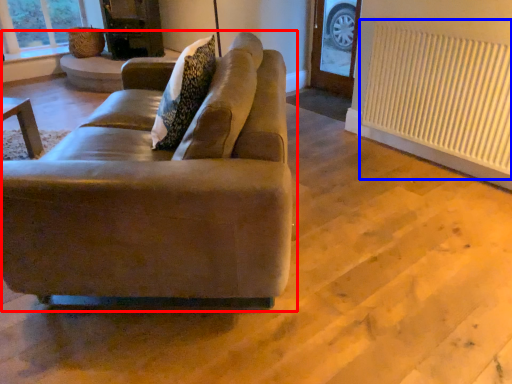
Question: Which of the following is the closest to the observer, studio couch (highlighted by a red box) or radiator (highlighted by a blue box)?

Choices:
 (A) studio couch
 (B) radiator

Answer: (A)